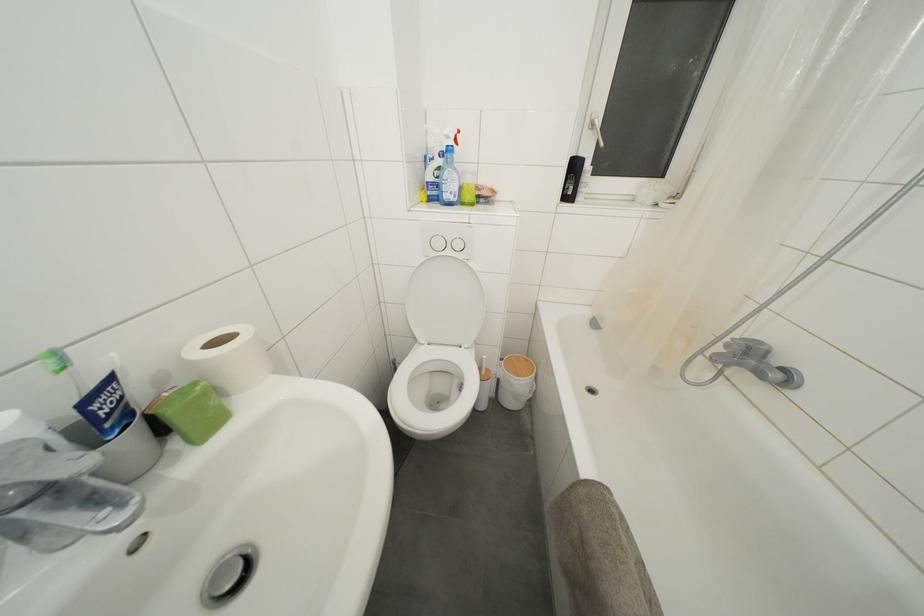
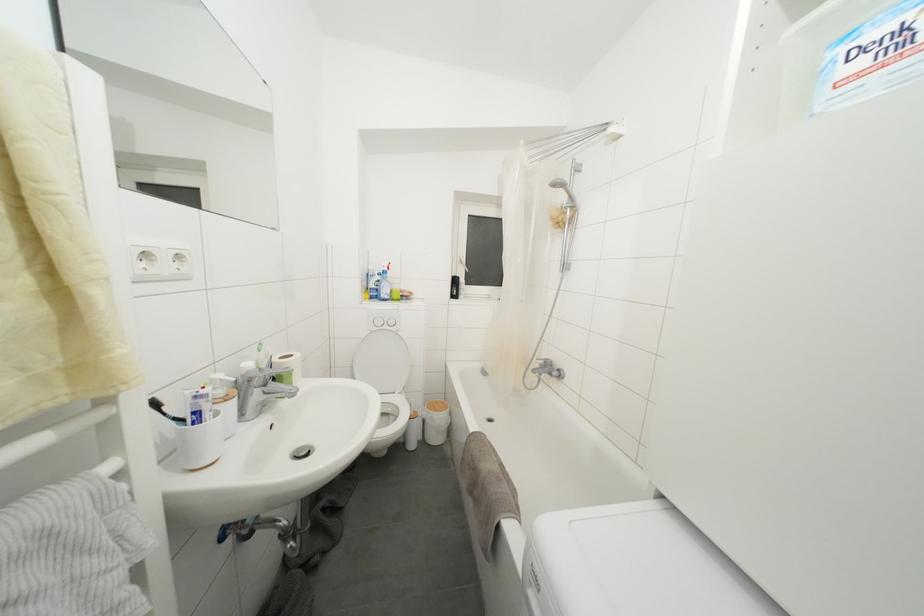
Find the pixel in the second image that matches point (438, 199) in the first image.

(379, 300)